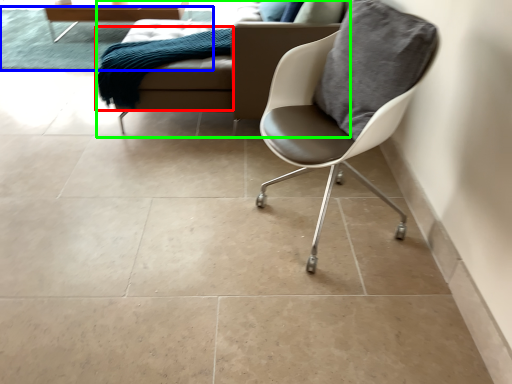
Question: Which object is the closest to the material (highlighted by a red box)? Choose among these: mat (highlighted by a blue box) or studio couch (highlighted by a green box).

Choices:
 (A) mat
 (B) studio couch

Answer: (B)